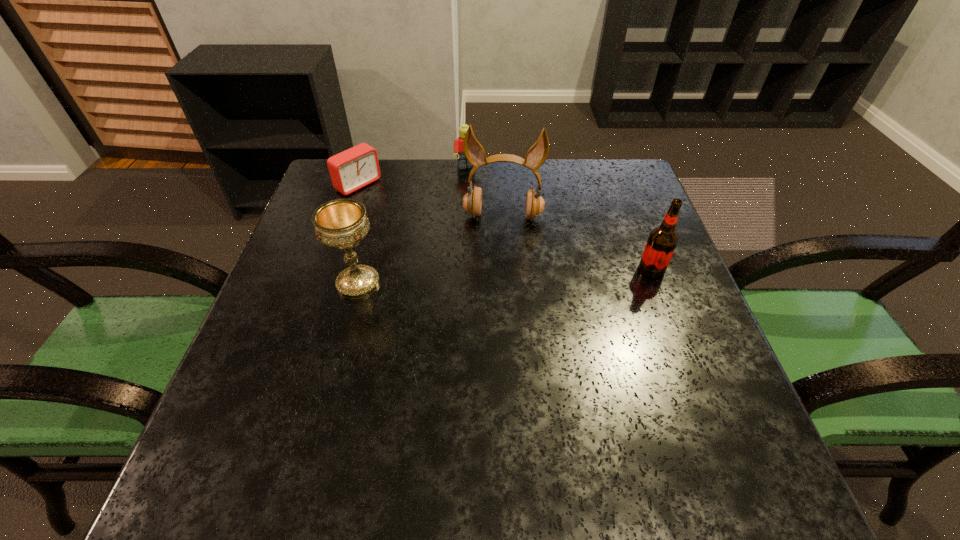
Find the location of a particular element. The width and height of the screenshot is (960, 540). chalice is located at coordinates pyautogui.click(x=341, y=223).

The height and width of the screenshot is (540, 960). Identify the location of the rightmost object. (662, 240).

Where is `the farthest object`? the farthest object is located at coordinates (462, 163).

Find the location of a particular element. Image resolution: width=960 pixels, height=540 pixels. Lego is located at coordinates (462, 163).

Identify the location of alarm clock. (357, 167).

You are a GUI agent. You are given a task and a screenshot of the screen. Output one action in this format:
    pyautogui.click(x=<x>, y=<y>)
    Task: Click on the shortest object
    The height and width of the screenshot is (540, 960).
    Given the screenshot: What is the action you would take?
    pyautogui.click(x=357, y=167)

In order to click on the tallest object in this screenshot , I will do `click(474, 152)`.

Where is `earphone`? The height and width of the screenshot is (540, 960). earphone is located at coordinates (474, 152).

Where is `free space located on the front of the chalice`? This screenshot has width=960, height=540. free space located on the front of the chalice is located at coordinates (345, 332).

Image resolution: width=960 pixels, height=540 pixels. Identify the location of free space located on the back of the rightmost object. click(x=616, y=178).